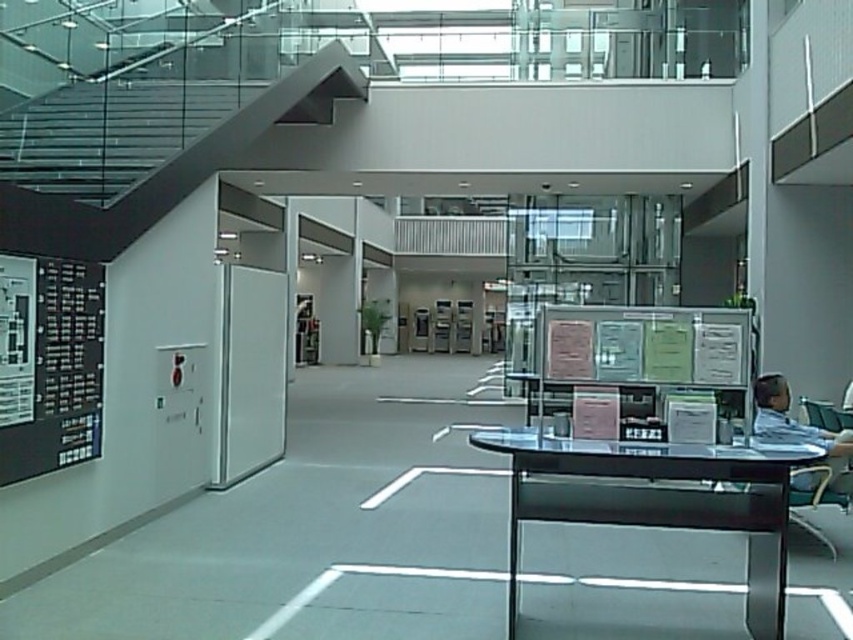
You are standing in the modern office space and need to reach a point closer to you. Which of the two points, point (20, 465) or point (833, 552), is nearer to your current position?

Point (20, 465) is closer to the viewer than point (833, 552), so you should head towards point (20, 465).

You are a delivery person standing at the entrance of the office. You need to place a package on the floor between the light blue shirt at right and the metallic silver chair at lower right. Is there enough space for the package?

The light blue shirt at right might be wider than metallic silver chair at lower right, so there might not be enough space for the package between them.